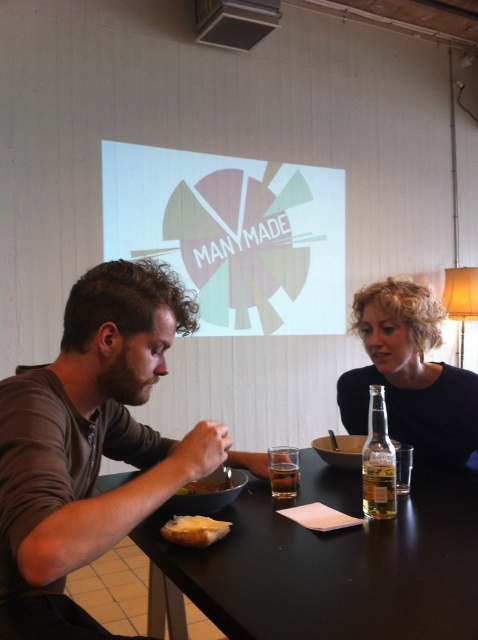
You are a waiter in a restaurant and need to place a small bowl of bread at the exact location of the point marked at coordinates point (89, 444). Based on the scene description, where should you place the bread bowl?

The point (89, 444) is on the brown matte shirt at left, so you should place the bread bowl on the brown matte shirt at left.

You are standing at the point labeled as point (395,509) in the image. You want to take a photo of the entire dining table scene. Considering your current position, will you be able to capture the entire table in your camera frame?

The point labeled as point (395,509) is 1.12 meters away from the camera. Since this distance is sufficient to capture the entire dining table scene, you can take a photo of the entire table from this position.